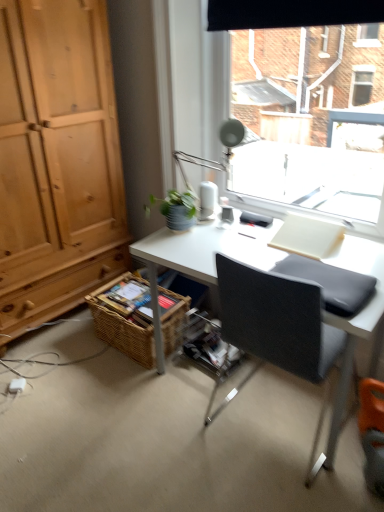
Measure the distance between point (x=134, y=350) and camera.

Point (x=134, y=350) and camera are 7.19 feet apart from each other.

What are the coordinates of `transparent glass window at upper center` in the screenshot? It's located at tap(303, 95).

In order to click on green matte plant at upper center in this screenshot , I will do `click(176, 209)`.

Image resolution: width=384 pixels, height=512 pixels. Identify the location of woven brown basket at lower left. (122, 327).

Considering the relative positions of black fabric chair at center and matte silver table lamp at upper center in the image provided, is black fabric chair at center to the left or to the right of matte silver table lamp at upper center?

black fabric chair at center is to the right of matte silver table lamp at upper center.

Which of these two, black fabric chair at center or matte silver table lamp at upper center, is thinner?

matte silver table lamp at upper center.

Considering the sizes of objects black fabric chair at center and matte silver table lamp at upper center in the image provided, who is taller, black fabric chair at center or matte silver table lamp at upper center?

black fabric chair at center.

How different are the orientations of black fabric chair at center and matte silver table lamp at upper center in degrees?

The facing directions of black fabric chair at center and matte silver table lamp at upper center are 177 degrees apart.

Image resolution: width=384 pixels, height=512 pixels. What are the coordinates of `basket below the transparent glass window at upper center (from the image's perspective)` in the screenshot? It's located at (122, 327).

Considering the positions of objects woven brown basket at lower left and transparent glass window at upper center in the image provided, who is behind, woven brown basket at lower left or transparent glass window at upper center?

woven brown basket at lower left is more distant.

Is woven brown basket at lower left positioned with its back to transparent glass window at upper center?

No, woven brown basket at lower left is not facing away from transparent glass window at upper center.

This screenshot has height=512, width=384. Identify the location of basket behind the green matte plant at upper center. point(122,327).

Between woven brown basket at lower left and green matte plant at upper center, which one has larger size?

woven brown basket at lower left.

Which object is further away from the camera, woven brown basket at lower left or green matte plant at upper center?

Positioned behind is woven brown basket at lower left.

Can you tell me how much transparent glass window at upper center and matte silver table lamp at upper center differ in facing direction?

transparent glass window at upper center and matte silver table lamp at upper center are facing 0.831 degrees away from each other.

Considering the relative sizes of transparent glass window at upper center and matte silver table lamp at upper center in the image provided, is transparent glass window at upper center wider than matte silver table lamp at upper center?

Yes.

Considering the positions of objects transparent glass window at upper center and matte silver table lamp at upper center in the image provided, who is more to the right, transparent glass window at upper center or matte silver table lamp at upper center?

From the viewer's perspective, transparent glass window at upper center appears more on the right side.

Is the surface of transparent glass window at upper center in direct contact with matte silver table lamp at upper center?

transparent glass window at upper center and matte silver table lamp at upper center are clearly separated.

From a real-world perspective, is matte silver table lamp at upper center positioned under green matte plant at upper center based on gravity?

No, from a real-world perspective, matte silver table lamp at upper center is not beneath green matte plant at upper center.

Is matte silver table lamp at upper center in contact with green matte plant at upper center?

matte silver table lamp at upper center is not next to green matte plant at upper center, and they're not touching.

Image resolution: width=384 pixels, height=512 pixels. Find the location of `houseplant behind the matte silver table lamp at upper center`. houseplant behind the matte silver table lamp at upper center is located at coordinates (176, 209).

Between point (232, 146) and point (178, 217), which one is positioned in front?

The point (178, 217) is closer to the camera.

How different are the orientations of matte silver table lamp at upper center and transparent glass window at upper center in degrees?

There is a 0.831-degree angle between the facing directions of matte silver table lamp at upper center and transparent glass window at upper center.

Is matte silver table lamp at upper center oriented away from transparent glass window at upper center?

Yes, matte silver table lamp at upper center's orientation is away from transparent glass window at upper center.

Considering the relative positions of matte silver table lamp at upper center and transparent glass window at upper center in the image provided, is matte silver table lamp at upper center to the right of transparent glass window at upper center from the viewer's perspective?

Incorrect, matte silver table lamp at upper center is not on the right side of transparent glass window at upper center.

Is matte silver table lamp at upper center bigger than transparent glass window at upper center?

No, matte silver table lamp at upper center is not bigger than transparent glass window at upper center.

In the scene shown: Which object is more forward, woven brown basket at lower left or black fabric chair at center?

black fabric chair at center is closer to the camera.

Is woven brown basket at lower left facing away from black fabric chair at center?

That's not correct — woven brown basket at lower left is not looking away from black fabric chair at center.

Based on the photo, from the image's perspective, who appears lower, woven brown basket at lower left or black fabric chair at center?

woven brown basket at lower left appears lower in the image.

Identify the location of chair below the matte silver table lamp at upper center (from a real-world perspective). The height and width of the screenshot is (512, 384). (276, 333).

Locate an element on the screen. The height and width of the screenshot is (512, 384). window in front of the woven brown basket at lower left is located at coordinates (303, 95).

Based on their spatial positions, is green matte plant at upper center or woven brown basket at lower left further from transparent glass window at upper center?

woven brown basket at lower left.

Estimate the real-world distances between objects in this image. Which object is closer to matte silver table lamp at upper center, black fabric chair at center or woven brown basket at lower left?

Among the two, woven brown basket at lower left is located nearer to matte silver table lamp at upper center.

Estimate the real-world distances between objects in this image. Which object is further from green matte plant at upper center, black fabric chair at center or matte silver table lamp at upper center?

Based on the image, black fabric chair at center appears to be further to green matte plant at upper center.

Considering their positions, is matte silver table lamp at upper center positioned further to black fabric chair at center than woven brown basket at lower left?

matte silver table lamp at upper center.

When comparing their distances from green matte plant at upper center, does black fabric chair at center or transparent glass window at upper center seem closer?

black fabric chair at center is closer to green matte plant at upper center.

Which object lies nearer to the anchor point transparent glass window at upper center, green matte plant at upper center or matte silver table lamp at upper center?

matte silver table lamp at upper center is positioned closer to the anchor transparent glass window at upper center.

Looking at the image, which one is located closer to matte silver table lamp at upper center, green matte plant at upper center or woven brown basket at lower left?

green matte plant at upper center.

Based on their spatial positions, is transparent glass window at upper center or black fabric chair at center further from woven brown basket at lower left?

transparent glass window at upper center.

Where is `chair that lies between transparent glass window at upper center and woven brown basket at lower left from top to bottom`? chair that lies between transparent glass window at upper center and woven brown basket at lower left from top to bottom is located at coordinates (276, 333).

Image resolution: width=384 pixels, height=512 pixels. In order to click on houseplant between black fabric chair at center and woven brown basket at lower left from front to back in this screenshot , I will do `click(176, 209)`.

Locate an element on the screen. table lamp between transparent glass window at upper center and black fabric chair at center vertically is located at coordinates coord(221,142).

At what (x,y) coordinates should I click in order to perform the action: click on table lamp positioned between transparent glass window at upper center and green matte plant at upper center from near to far. Please return your answer as a coordinate pair (x, y). This screenshot has width=384, height=512. Looking at the image, I should click on tap(221, 142).